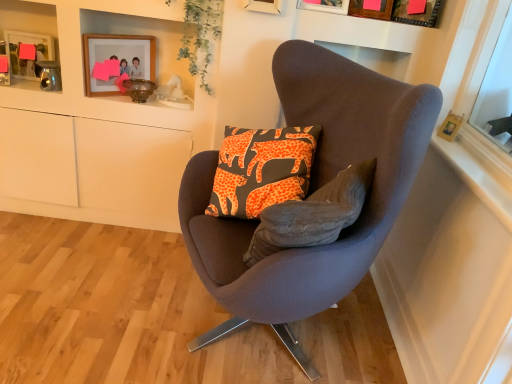
The image size is (512, 384). Describe the element at coordinates (371, 9) in the screenshot. I see `wooden picture frame at upper center, the 4th picture frame positioned from the left` at that location.

What do you see at coordinates (200, 36) in the screenshot? This screenshot has width=512, height=384. I see `green leafy plant at upper center` at bounding box center [200, 36].

Find the location of a particular element. wooden picture frame at upper center, the third picture frame from the left is located at coordinates (325, 6).

From the image's perspective, is green leafy plant at upper center located above or below brushed metal picture frame at upper left, acting as the first picture frame starting from the left?

From the image's perspective, green leafy plant at upper center appears above brushed metal picture frame at upper left, acting as the first picture frame starting from the left.

From a real-world perspective, is green leafy plant at upper center positioned above or below brushed metal picture frame at upper left, acting as the first picture frame starting from the left?

In terms of real-world spatial position, green leafy plant at upper center is above brushed metal picture frame at upper left, acting as the first picture frame starting from the left.

How different are the orientations of green leafy plant at upper center and brushed metal picture frame at upper left, acting as the first picture frame starting from the left, in degrees?

There is a 16.4-degree angle between the facing directions of green leafy plant at upper center and brushed metal picture frame at upper left, acting as the first picture frame starting from the left.

Image resolution: width=512 pixels, height=384 pixels. Find the location of `plant in front of the brushed metal picture frame at upper left, acting as the first picture frame starting from the left`. plant in front of the brushed metal picture frame at upper left, acting as the first picture frame starting from the left is located at coordinates (200, 36).

Does point (442, 5) appear closer or farther from the camera than point (309, 5)?

Clearly, point (442, 5) is more distant from the camera than point (309, 5).

Is wooden picture frame at upper right, which is the 1th picture frame from right to left, touching wooden picture frame at upper center, the 3th picture frame viewed from the right?

wooden picture frame at upper right, which is the 1th picture frame from right to left, is not next to wooden picture frame at upper center, the 3th picture frame viewed from the right, and they're not touching.

Can wooden picture frame at upper center, the third picture frame from the left, be found inside wooden picture frame at upper right, which is the 1th picture frame from right to left?

No, wooden picture frame at upper center, the third picture frame from the left, is not inside wooden picture frame at upper right, which is the 1th picture frame from right to left.

Is suede-like brown chair at center facing towards wooden frame at upper right?

No, suede-like brown chair at center is not aimed at wooden frame at upper right.

Considering the sizes of objects suede-like brown chair at center and wooden frame at upper right in the image provided, who is wider, suede-like brown chair at center or wooden frame at upper right?

suede-like brown chair at center.

Is wooden frame at upper right a part of suede-like brown chair at center?

No, wooden frame at upper right is not inside suede-like brown chair at center.

Considering the sizes of objects matte wooden picture frame at upper center, the 4th picture frame when ordered from right to left, and wooden picture frame at upper center, the third picture frame from the left, in the image provided, who is wider, matte wooden picture frame at upper center, the 4th picture frame when ordered from right to left, or wooden picture frame at upper center, the third picture frame from the left,?

wooden picture frame at upper center, the third picture frame from the left, is wider.

Can you confirm if matte wooden picture frame at upper center, the second picture frame from the left, is positioned to the left of wooden picture frame at upper center, the 3th picture frame viewed from the right?

Indeed, matte wooden picture frame at upper center, the second picture frame from the left, is positioned on the left side of wooden picture frame at upper center, the 3th picture frame viewed from the right.

Considering the relative sizes of matte wooden picture frame at upper center, the second picture frame from the left, and wooden picture frame at upper center, the third picture frame from the left, in the image provided, is matte wooden picture frame at upper center, the second picture frame from the left, shorter than wooden picture frame at upper center, the third picture frame from the left,?

No.

Considering the relative positions of matte wooden picture frame at upper center, the second picture frame from the left, and wooden picture frame at upper center, the 3th picture frame viewed from the right, in the image provided, is matte wooden picture frame at upper center, the second picture frame from the left, behind wooden picture frame at upper center, the 3th picture frame viewed from the right,?

No, matte wooden picture frame at upper center, the second picture frame from the left, is closer to the camera.

Based on the photo, does green leafy plant at upper center have a lesser width compared to wooden picture frame at upper center, the 3th picture frame viewed from the right?

No.

Is green leafy plant at upper center positioned beyond the bounds of wooden picture frame at upper center, the third picture frame from the left?

green leafy plant at upper center lies outside wooden picture frame at upper center, the third picture frame from the left,'s area.

Who is smaller, wooden picture frame at upper center, positioned as the 2th picture frame in right-to-left order, or brushed metal picture frame at upper left, which appears as the fifth picture frame when viewed from the right?

Smaller between the two is brushed metal picture frame at upper left, which appears as the fifth picture frame when viewed from the right.

Considering the points (355, 6) and (9, 66), which point is behind, point (355, 6) or point (9, 66)?

Positioned behind is point (9, 66).

From the image's perspective, is wooden picture frame at upper center, the 4th picture frame positioned from the left, above or below brushed metal picture frame at upper left, which appears as the fifth picture frame when viewed from the right?

wooden picture frame at upper center, the 4th picture frame positioned from the left, is above brushed metal picture frame at upper left, which appears as the fifth picture frame when viewed from the right.

Which object is positioned more to the left, suede-like brown chair at center or wooden picture frame at upper center, positioned as the 2th picture frame in right-to-left order?

From the viewer's perspective, suede-like brown chair at center appears more on the left side.

Which of these two, suede-like brown chair at center or wooden picture frame at upper center, positioned as the 2th picture frame in right-to-left order, is smaller?

With smaller size is wooden picture frame at upper center, positioned as the 2th picture frame in right-to-left order.

Based on the photo, is suede-like brown chair at center shorter than wooden picture frame at upper center, positioned as the 2th picture frame in right-to-left order?

Incorrect, the height of suede-like brown chair at center does not fall short of that of wooden picture frame at upper center, positioned as the 2th picture frame in right-to-left order.

Where is `plant in front of the brushed metal picture frame at upper left, acting as the first picture frame starting from the left`? This screenshot has height=384, width=512. plant in front of the brushed metal picture frame at upper left, acting as the first picture frame starting from the left is located at coordinates (200, 36).

From the image's perspective, starting from the wooden picture frame at upper right, which is the 1th picture frame from right to left, which picture frame is the 3rd one above? Please provide its 2D coordinates.

[(325, 6)]

Based on their spatial positions, is matte wooden picture frame at upper center, the 4th picture frame when ordered from right to left, or suede-like brown chair at center further from wooden picture frame at upper right, which is the 1th picture frame from right to left?

The object further to wooden picture frame at upper right, which is the 1th picture frame from right to left, is suede-like brown chair at center.

Estimate the real-world distances between objects in this image. Which object is closer to wooden picture frame at upper right, which is the 1th picture frame from right to left, matte wooden picture frame at upper center, the 4th picture frame when ordered from right to left, or brushed metal picture frame at upper left, which appears as the fifth picture frame when viewed from the right?

matte wooden picture frame at upper center, the 4th picture frame when ordered from right to left, is positioned closer to the anchor wooden picture frame at upper right, which is the 1th picture frame from right to left.

Based on their spatial positions, is wooden frame at upper right or wooden picture frame at upper center, the 3th picture frame viewed from the right, closer to matte wooden picture frame at upper center, the second picture frame from the left?

The object closer to matte wooden picture frame at upper center, the second picture frame from the left, is wooden picture frame at upper center, the 3th picture frame viewed from the right.

Estimate the real-world distances between objects in this image. Which object is further from suede-like brown chair at center, wooden picture frame at upper center, the 4th picture frame positioned from the left, or wooden picture frame at upper center, the 3th picture frame viewed from the right?

Among the two, wooden picture frame at upper center, the 4th picture frame positioned from the left, is located further to suede-like brown chair at center.

Based on their spatial positions, is brushed metal picture frame at upper left, acting as the first picture frame starting from the left, or suede-like brown chair at center closer to wooden picture frame at upper center, the 4th picture frame positioned from the left?

Based on the image, suede-like brown chair at center appears to be nearer to wooden picture frame at upper center, the 4th picture frame positioned from the left.

In the scene shown: From the image, which object appears to be nearer to brushed metal picture frame at upper left, which appears as the fifth picture frame when viewed from the right, wooden frame at upper right or wooden picture frame at upper center, the 4th picture frame positioned from the left?

The object closer to brushed metal picture frame at upper left, which appears as the fifth picture frame when viewed from the right, is wooden picture frame at upper center, the 4th picture frame positioned from the left.

Based on the photo, which object lies further to the anchor point green leafy plant at upper center, wooden picture frame at upper center, the 4th picture frame positioned from the left, or suede-like brown chair at center?

suede-like brown chair at center is further to green leafy plant at upper center.

Based on their spatial positions, is suede-like brown chair at center or brushed metal picture frame at upper left, acting as the first picture frame starting from the left, further from wooden picture frame at upper right, which is the 1th picture frame from right to left?

Based on the image, brushed metal picture frame at upper left, acting as the first picture frame starting from the left, appears to be further to wooden picture frame at upper right, which is the 1th picture frame from right to left.

I want to click on plant positioned between suede-like brown chair at center and wooden picture frame at upper right, the 5th picture frame viewed from the left, from near to far, so click(200, 36).

What are the coordinates of `plant situated between brushed metal picture frame at upper left, which appears as the fifth picture frame when viewed from the right, and wooden picture frame at upper right, which is the 1th picture frame from right to left, from left to right` in the screenshot? It's located at (200, 36).

Locate an element on the screen. The height and width of the screenshot is (384, 512). plant located between suede-like brown chair at center and wooden picture frame at upper center, the 3th picture frame viewed from the right, in the depth direction is located at coordinates (200, 36).

I want to click on picture frame between suede-like brown chair at center and green leafy plant at upper center in the front-back direction, so click(264, 6).